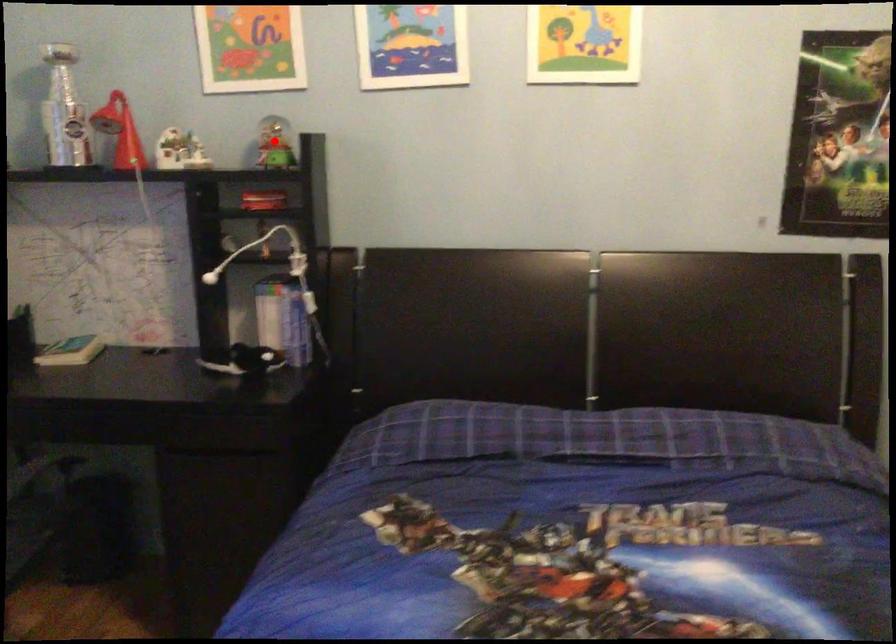
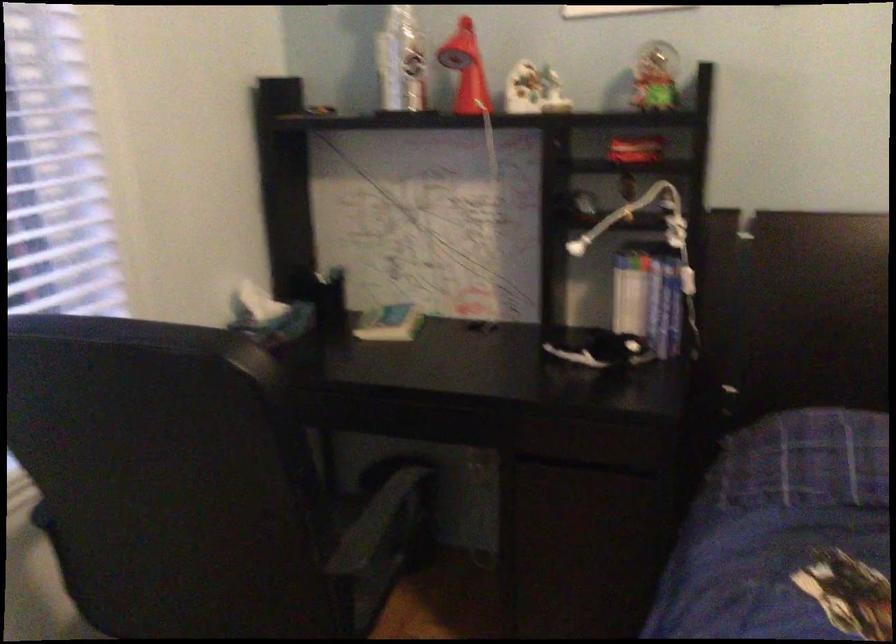
Find the pixel in the second image that matches the highlighted location in the first image.

(655, 77)